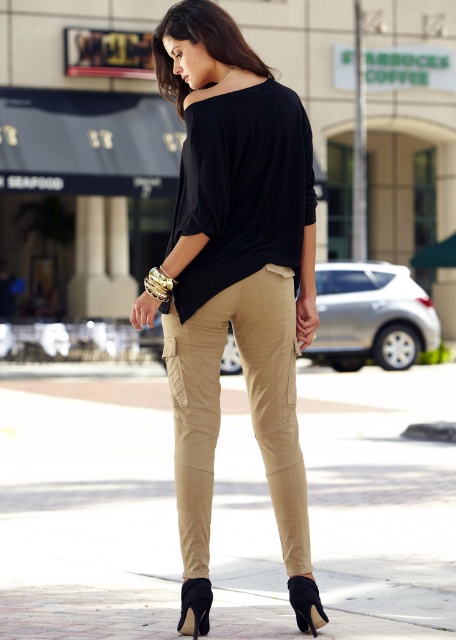
You are a fashion designer observing the woman in the scene. You need to determine if the matte khaki pants at center can comfortably accommodate the black suede sandal at lower center in terms of width. Can they?

The matte khaki pants at center might be wider than black suede sandal at lower center, so there is a possibility that the pants are wide enough to comfortably accommodate the sandal.

You are a photographer trying to capture the woman in the image. You want to ensure that the black suede sandal at lower center is visible in the frame. Given that the camera sensor has a field of view covering coordinates from 0.0 to 1.0 in both x and y axes, will the sandal be within the frame?

The black suede sandal at lower center is positioned at coordinates point (195, 605), which falls within the camera sensor field of view from 0.0 to 1.0 in both axes. Therefore, the sandal will be visible in the frame.